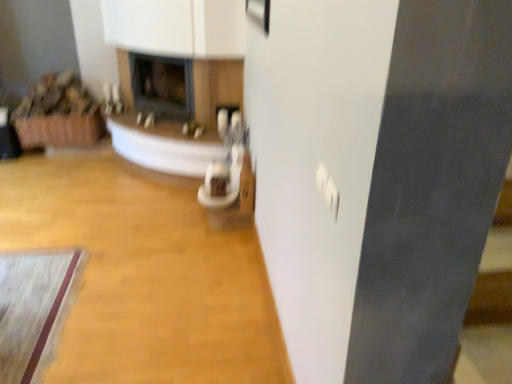
Question: Considering the relative positions of matte black fireplace at center, the second fireplace positioned from the left, and wooden floor at center in the image provided, is matte black fireplace at center, the second fireplace positioned from the left, to the left of wooden floor at center from the viewer's perspective?

Choices:
 (A) yes
 (B) no

Answer: (B)

Question: From the image's perspective, would you say matte black fireplace at center, the second fireplace positioned from the left, is positioned over wooden floor at center?

Choices:
 (A) yes
 (B) no

Answer: (A)

Question: Does matte black fireplace at center, the second fireplace positioned from the left, lie behind wooden floor at center?

Choices:
 (A) no
 (B) yes

Answer: (B)

Question: From a real-world perspective, is matte black fireplace at center, the second fireplace positioned from the left, located beneath wooden floor at center?

Choices:
 (A) yes
 (B) no

Answer: (B)

Question: Is matte black fireplace at center, acting as the first fireplace starting from the right, next to wooden floor at center and touching it?

Choices:
 (A) yes
 (B) no

Answer: (B)

Question: From the image's perspective, relative to matte black fireplace at center, the first fireplace when ordered from left to right, is matte black fireplace at center, the second fireplace positioned from the left, above or below?

Choices:
 (A) above
 (B) below

Answer: (B)

Question: Is point (206, 102) positioned closer to the camera than point (169, 92)?

Choices:
 (A) closer
 (B) farther

Answer: (A)

Question: From a real-world perspective, relative to matte black fireplace at center, the first fireplace when ordered from left to right, is matte black fireplace at center, the second fireplace positioned from the left, vertically above or below?

Choices:
 (A) above
 (B) below

Answer: (A)

Question: Visually, is matte black fireplace at center, acting as the first fireplace starting from the right, positioned to the left or to the right of matte black fireplace at center, the first fireplace when ordered from left to right?

Choices:
 (A) right
 (B) left

Answer: (A)

Question: From the image's perspective, is matte black fireplace at center, the first fireplace when ordered from left to right, positioned above or below matte black fireplace at center, acting as the first fireplace starting from the right?

Choices:
 (A) above
 (B) below

Answer: (A)

Question: Is point (150, 79) positioned closer to the camera than point (172, 127)?

Choices:
 (A) closer
 (B) farther

Answer: (B)

Question: Considering the positions of matte black fireplace at center, the first fireplace when ordered from left to right, and matte black fireplace at center, acting as the first fireplace starting from the right, in the image, is matte black fireplace at center, the first fireplace when ordered from left to right, bigger or smaller than matte black fireplace at center, acting as the first fireplace starting from the right,?

Choices:
 (A) small
 (B) big

Answer: (A)

Question: Would you say matte black fireplace at center, the first fireplace when ordered from left to right, is to the left or to the right of matte black fireplace at center, the second fireplace positioned from the left, in the picture?

Choices:
 (A) right
 (B) left

Answer: (B)

Question: From the image's perspective, is wooden floor at center above or below matte black fireplace at center, acting as the first fireplace starting from the right?

Choices:
 (A) below
 (B) above

Answer: (A)

Question: Which is correct: wooden floor at center is inside matte black fireplace at center, the second fireplace positioned from the left, or outside of it?

Choices:
 (A) outside
 (B) inside

Answer: (A)